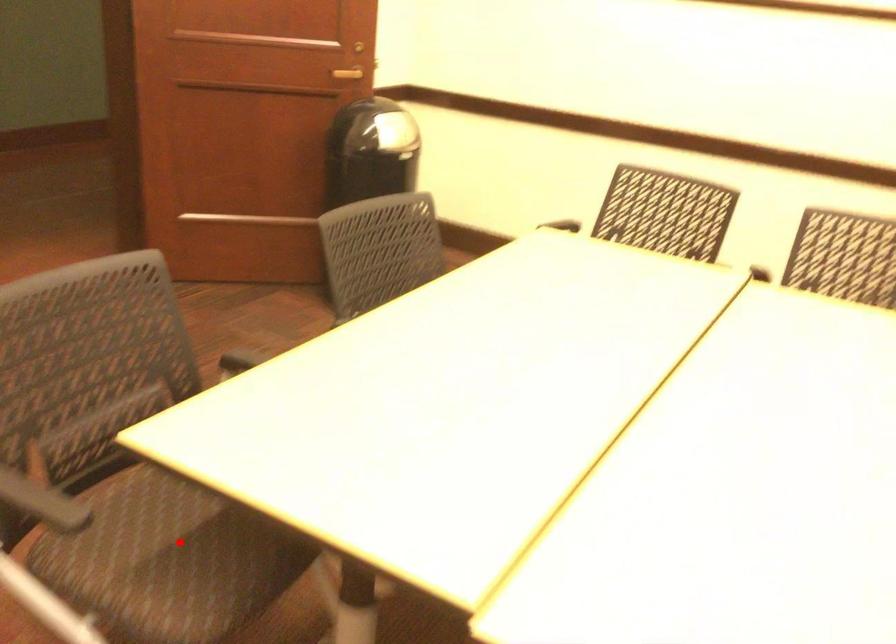
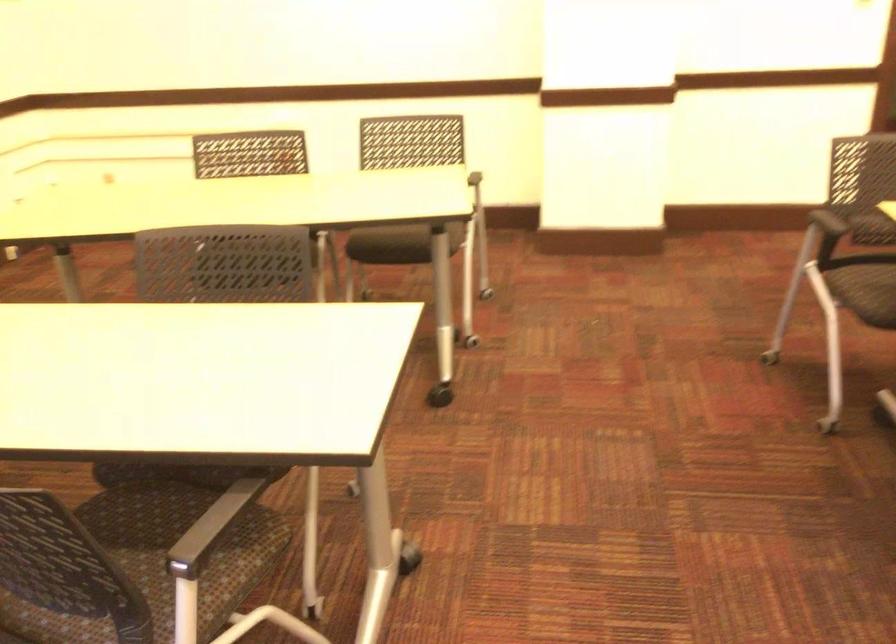
Question: I am providing you with two images of the same scene from different viewpoints. In image1, a red point is highlighted. Considering the same 3D point in image2, which of the following is correct?

Choices:
 (A) It is closer
 (B) It is farther

Answer: (B)